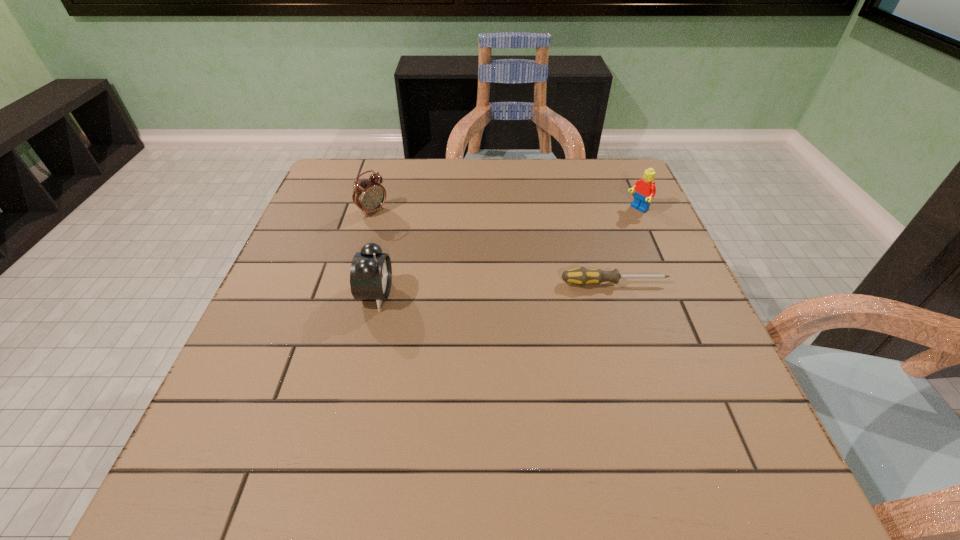
Where is `blank area located on the face of the Lego`? blank area located on the face of the Lego is located at coordinates (525, 278).

At what (x,y) coordinates should I click in order to perform the action: click on alarm clock that is at the far edge. Please return your answer as a coordinate pair (x, y). The image size is (960, 540). Looking at the image, I should click on (369, 195).

I want to click on Lego at the far edge, so click(x=645, y=189).

Where is `object present at the left edge`? This screenshot has height=540, width=960. object present at the left edge is located at coordinates (369, 195).

This screenshot has height=540, width=960. Find the location of `screwdriver located at the right edge`. screwdriver located at the right edge is located at coordinates (581, 276).

This screenshot has width=960, height=540. In order to click on Lego that is at the right edge in this screenshot , I will do `click(645, 189)`.

Where is `object that is at the far left corner`? The width and height of the screenshot is (960, 540). object that is at the far left corner is located at coordinates (369, 195).

The height and width of the screenshot is (540, 960). Find the location of `object located at the far right corner`. object located at the far right corner is located at coordinates (645, 189).

Where is `vacant space at the far edge`? vacant space at the far edge is located at coordinates (395, 181).

The width and height of the screenshot is (960, 540). I want to click on vacant space at the near edge of the desktop, so click(334, 432).